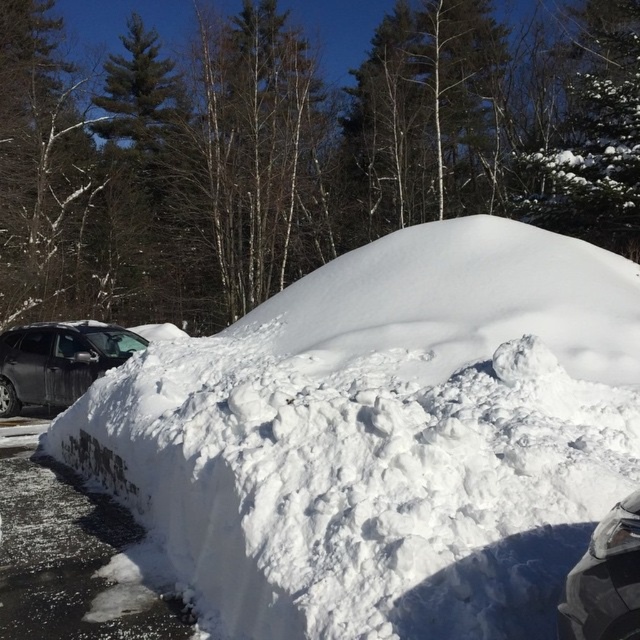
Question: Observing the image, what is the correct spatial positioning of white fluffy snow at center in reference to glossy black car at lower right?

Choices:
 (A) left
 (B) right

Answer: (A)

Question: Can you confirm if white fluffy snow at center is wider than matte black suv at left?

Choices:
 (A) yes
 (B) no

Answer: (A)

Question: Estimate the real-world distances between objects in this image. Which object is farther from the matte black suv at left?

Choices:
 (A) glossy black car at lower right
 (B) white fluffy snow at center

Answer: (A)

Question: Among these points, which one is farthest from the camera?

Choices:
 (A) (106, 337)
 (B) (518, 364)
 (C) (602, 534)

Answer: (A)

Question: Is white fluffy snow at center positioned in front of matte black suv at left?

Choices:
 (A) no
 (B) yes

Answer: (B)

Question: Which of the following is the farthest from the observer?

Choices:
 (A) (102, 344)
 (B) (563, 435)

Answer: (A)